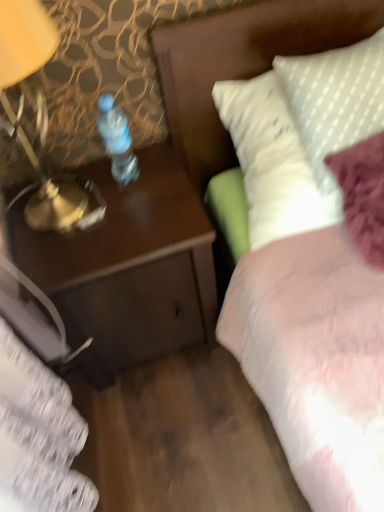
Find the location of a particular element. Image resolution: width=384 pixels, height=512 pixels. vacant area located to the right-hand side of clear plastic bottle at center is located at coordinates (162, 167).